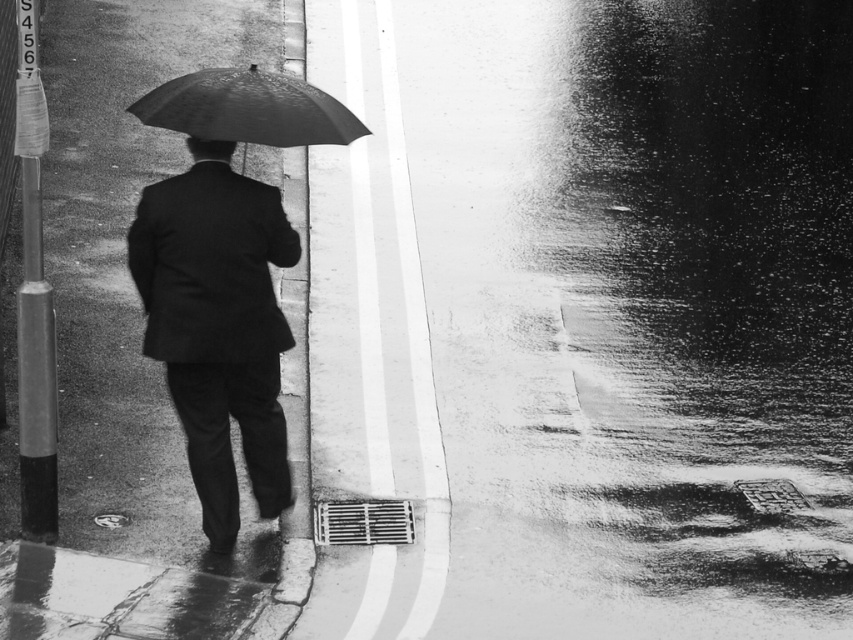
Question: Which object appears farthest from the camera in this image?

Choices:
 (A) shiny black umbrella at center
 (B) matte black suit at center

Answer: (B)

Question: Is matte black suit at center positioned at the back of shiny black umbrella at center?

Choices:
 (A) no
 (B) yes

Answer: (B)

Question: Can you confirm if matte black suit at center is positioned to the left of shiny black umbrella at center?

Choices:
 (A) yes
 (B) no

Answer: (A)

Question: Among these objects, which one is nearest to the camera?

Choices:
 (A) matte black suit at center
 (B) shiny black umbrella at center

Answer: (B)

Question: Which point is farther to the camera?

Choices:
 (A) (256, 180)
 (B) (231, 120)

Answer: (A)

Question: Can you confirm if matte black suit at center is positioned below shiny black umbrella at center?

Choices:
 (A) no
 (B) yes

Answer: (B)